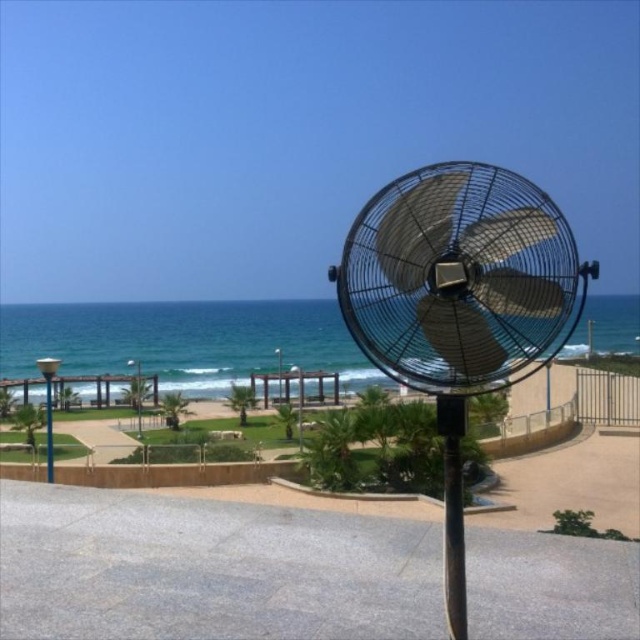
Question: Which is farther from the metallic pole at left?

Choices:
 (A) black matte pole at center
 (B) metallic black fan at center

Answer: (A)

Question: In this image, where is metallic black fan at center located relative to black matte pole at center?

Choices:
 (A) above
 (B) below

Answer: (B)

Question: Which point is closer to the camera?

Choices:
 (A) metallic pole at left
 (B) metallic black fan at center
 (C) black matte pole at center

Answer: (B)

Question: Which of the following is the farthest from the observer?

Choices:
 (A) black matte pole at center
 (B) metallic pole at left
 (C) metallic black fan at center

Answer: (B)

Question: Does metallic black fan at center have a smaller size compared to black matte pole at center?

Choices:
 (A) no
 (B) yes

Answer: (A)

Question: From the image, what is the correct spatial relationship of metallic black fan at center in relation to metallic pole at left?

Choices:
 (A) above
 (B) below

Answer: (A)